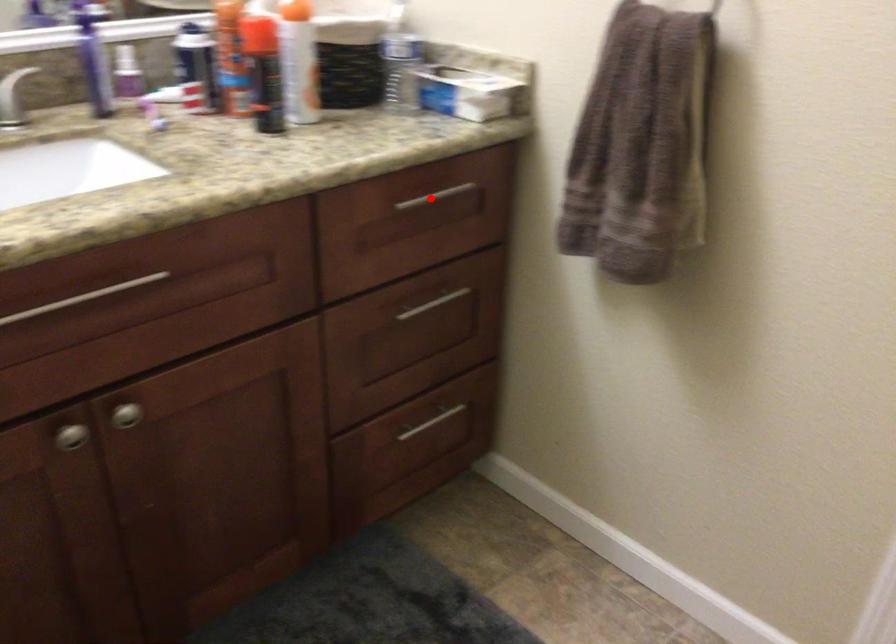
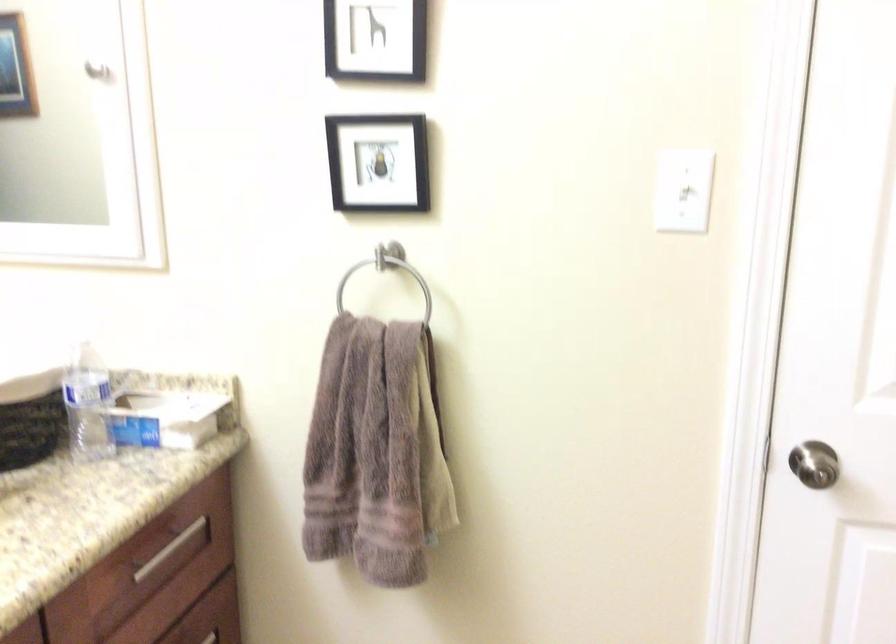
Find the pixel in the second image that matches the highlighted location in the first image.

(168, 549)